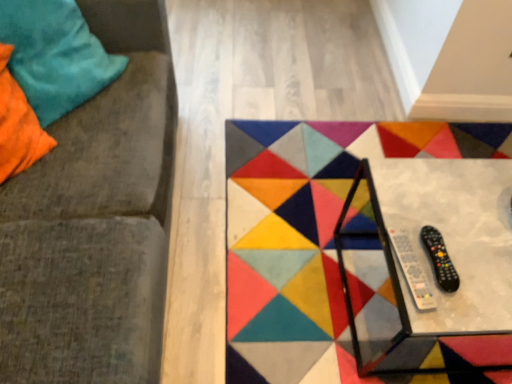
Where is `vacant space behind black plastic remote at lower right`? The image size is (512, 384). vacant space behind black plastic remote at lower right is located at coordinates (411, 204).